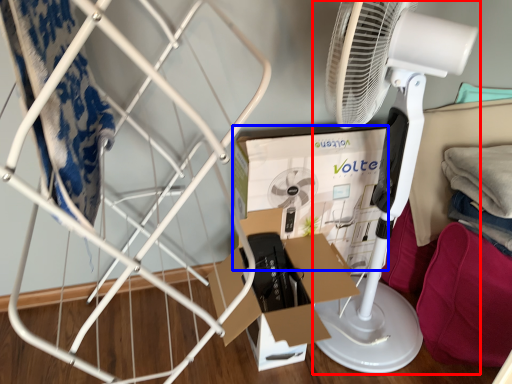
Question: Among these objects, which one is nearest to the camera, mechanical fan (highlighted by a red box) or box (highlighted by a blue box)?

Choices:
 (A) mechanical fan
 (B) box

Answer: (A)